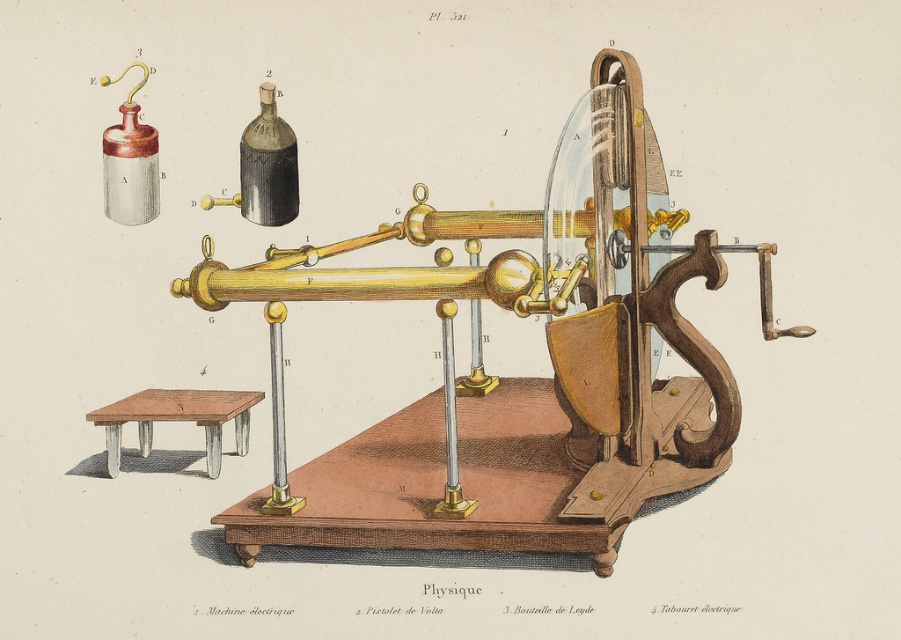
Can you confirm if polished brass telescope at center is smaller than matte black glass bottle at upper center?

No.

The image size is (901, 640). What do you see at coordinates (516, 378) in the screenshot?
I see `polished brass telescope at center` at bounding box center [516, 378].

Between point (596, 212) and point (296, 157), which one is positioned in front?

Point (596, 212) is in front.

You are a GUI agent. You are given a task and a screenshot of the screen. Output one action in this format:
    pyautogui.click(x=<x>, y=<y>)
    Task: Click on the polished brass telescope at center
    Image resolution: width=901 pixels, height=640 pixels.
    Given the screenshot: What is the action you would take?
    pyautogui.click(x=516, y=378)

Does polished brass telescope at center appear on the right side of wooden stool at lower left?

Indeed, polished brass telescope at center is positioned on the right side of wooden stool at lower left.

Who is higher up, polished brass telescope at center or wooden stool at lower left?

polished brass telescope at center

I want to click on polished brass telescope at center, so click(x=516, y=378).

Is wooden stool at lower left thinner than matte black glass bottle at upper center?

In fact, wooden stool at lower left might be wider than matte black glass bottle at upper center.

Locate an element on the screen. This screenshot has width=901, height=640. wooden stool at lower left is located at coordinates (177, 419).

Find the location of a particular element. This screenshot has width=901, height=640. wooden stool at lower left is located at coordinates (177, 419).